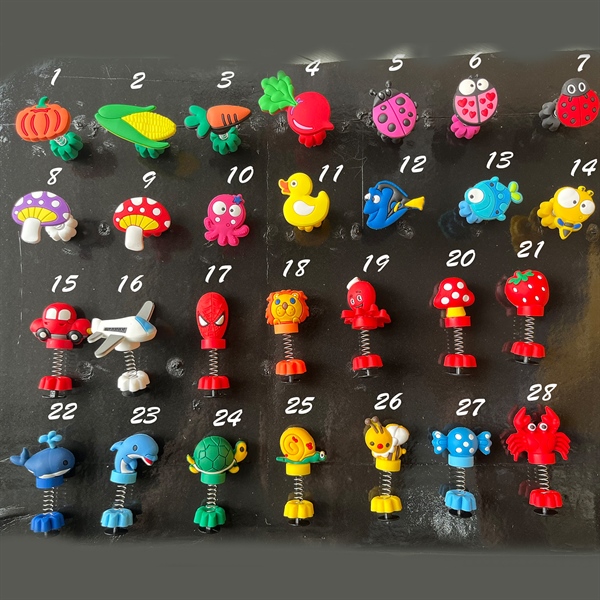
This screenshot has height=600, width=600. Find the location of `third column of toys`. third column of toys is located at coordinates (220, 117), (226, 220), (218, 309), (215, 448).